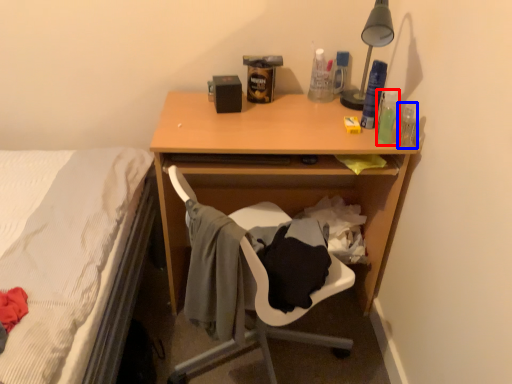
Question: Which of the following is the farthest to the observer, bottle (highlighted by a red box) or bottle (highlighted by a blue box)?

Choices:
 (A) bottle
 (B) bottle

Answer: (B)